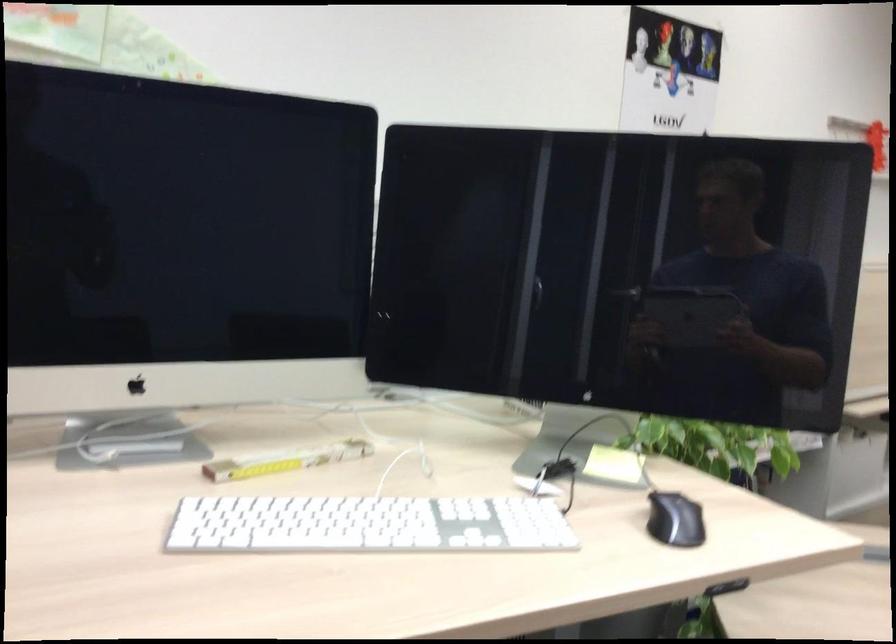
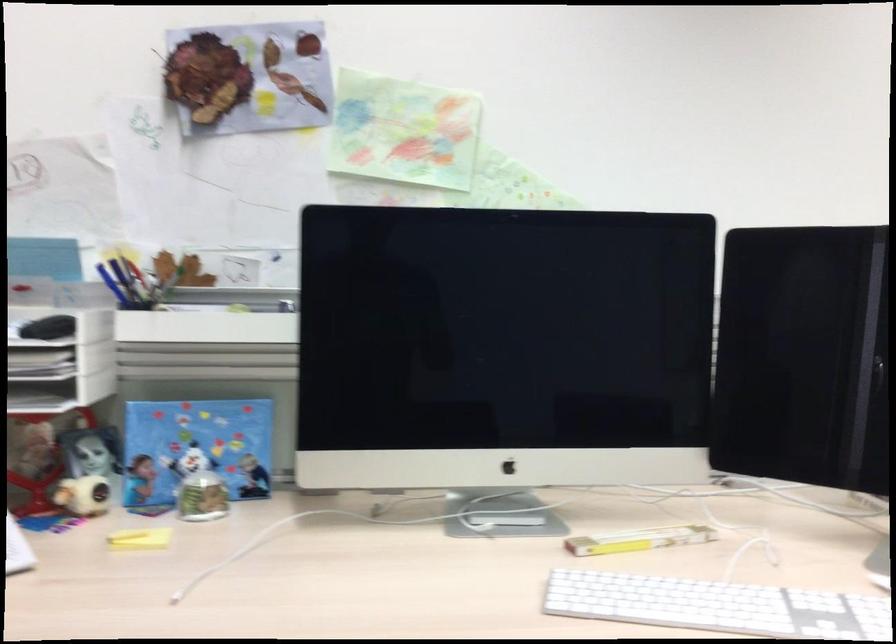
Locate, in the second image, the point that corresponds to point 357,523 in the first image.

(717, 605)